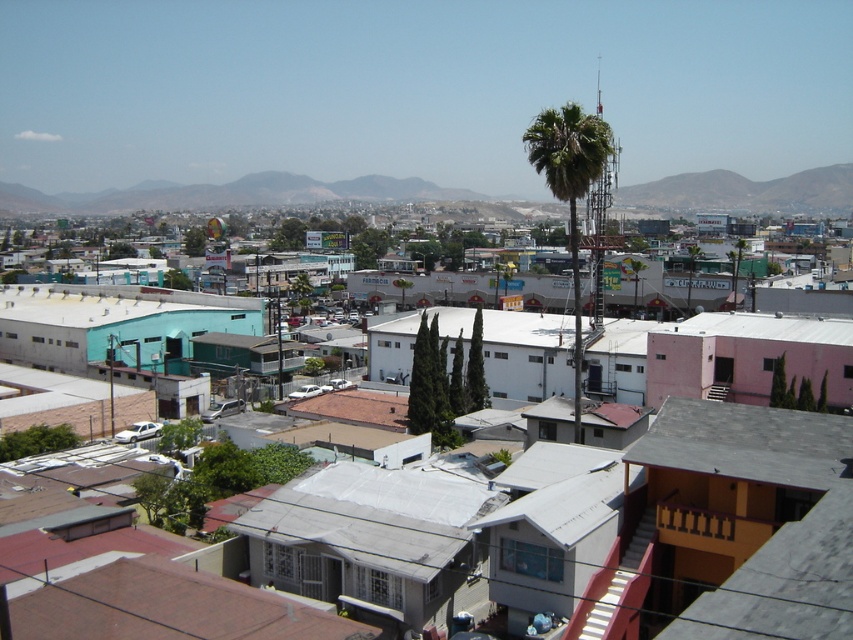
Does gray/rocky mountain at upper center have a smaller size compared to brown tile roof at lower left?

Incorrect, gray/rocky mountain at upper center is not smaller in size than brown tile roof at lower left.

Who is more forward, (849, 163) or (177, 593)?

Point (177, 593)

In order to click on gray/rocky mountain at upper center in this screenshot , I will do `click(228, 195)`.

Can you confirm if gray/rocky mountain at upper center is bigger than green leafy palm tree at center-right?

Incorrect, gray/rocky mountain at upper center is not larger than green leafy palm tree at center-right.

Between point (300, 173) and point (575, 317), which one is positioned behind?

Point (300, 173)

You are a GUI agent. You are given a task and a screenshot of the screen. Output one action in this format:
    pyautogui.click(x=<x>, y=<y>)
    Task: Click on the gray/rocky mountain at upper center
    
    Given the screenshot: What is the action you would take?
    pyautogui.click(x=228, y=195)

Is brown tile roof at lower left bigger than green leafy palm tree at center-right?

Incorrect, brown tile roof at lower left is not larger than green leafy palm tree at center-right.

What do you see at coordinates (167, 608) in the screenshot? I see `brown tile roof at lower left` at bounding box center [167, 608].

Locate an element on the screen. This screenshot has width=853, height=640. brown tile roof at lower left is located at coordinates (167, 608).